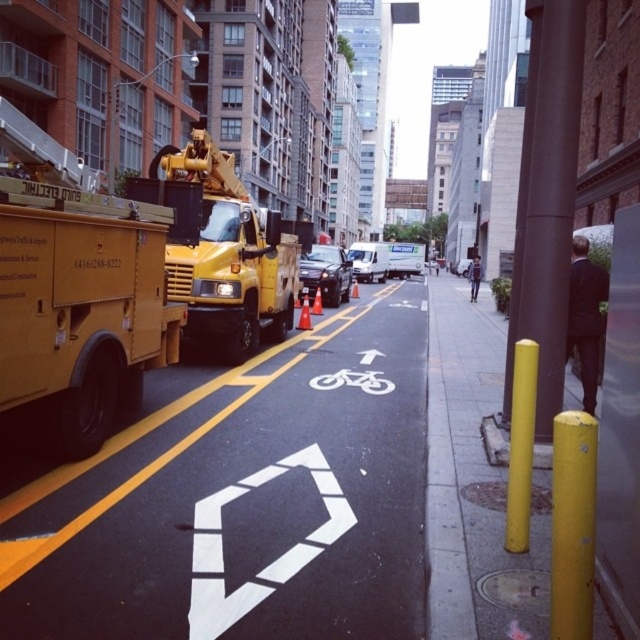
Is matte yellow utility truck at left taller than matte yellow truck at center?

In fact, matte yellow utility truck at left may be shorter than matte yellow truck at center.

Is point (150, 362) farther from camera compared to point (212, 266)?

No, (150, 362) is in front of (212, 266).

Is point (172, 321) farther from viewer compared to point (173, 198)?

No, it is not.

Where is `matte yellow utility truck at left`? This screenshot has width=640, height=640. matte yellow utility truck at left is located at coordinates (76, 291).

Between white painted bike lane at center and matte yellow utility truck at left, which one has more height?

matte yellow utility truck at left

From the picture: Does white painted bike lane at center have a lesser height compared to matte yellow utility truck at left?

Correct, white painted bike lane at center is not as tall as matte yellow utility truck at left.

Image resolution: width=640 pixels, height=640 pixels. In order to click on white painted bike lane at center in this screenshot , I will do `click(244, 499)`.

Identify the location of white painted bike lane at center. The image size is (640, 640). (244, 499).

Which is more to the left, white painted bike lane at center or matte yellow truck at center?

matte yellow truck at center is more to the left.

Is point (232, 532) farther from viewer compared to point (244, 189)?

That is False.

Is point (22, 636) less distant than point (198, 253)?

Yes, it is in front of point (198, 253).

Locate an element on the screen. white painted bike lane at center is located at coordinates (244, 499).